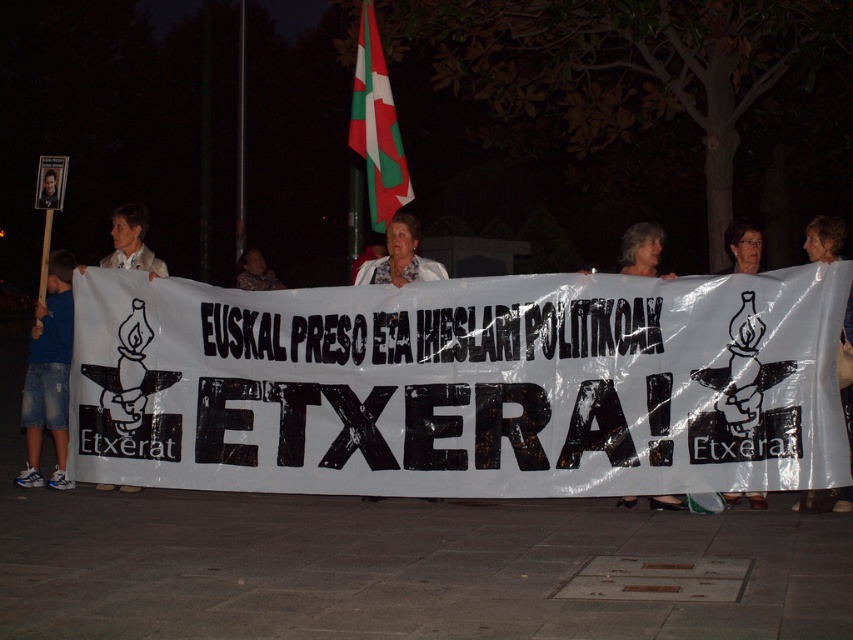
Question: Estimate the real-world distances between objects in this image. Which object is closer to the green and white fabric flag at upper center?

Choices:
 (A) smooth plastic sign at upper left
 (B) white plastic bag at center

Answer: (A)

Question: Does white plastic bag at center lie behind smooth plastic sign at upper left?

Choices:
 (A) no
 (B) yes

Answer: (A)

Question: Among these objects, which one is farthest from the camera?

Choices:
 (A) smooth plastic sign at upper left
 (B) transparent plastic bag at right

Answer: (A)

Question: Is blue denim shorts at left to the left of camouflage fabric shirt at center from the viewer's perspective?

Choices:
 (A) no
 (B) yes

Answer: (B)

Question: In this image, where is white paper banner at center located relative to white plastic bag at center?

Choices:
 (A) left
 (B) right

Answer: (A)

Question: Which object is positioned closest to the white paper banner at center?

Choices:
 (A) blue denim shorts at left
 (B) camouflage fabric shirt at center
 (C) transparent plastic bag at right

Answer: (C)